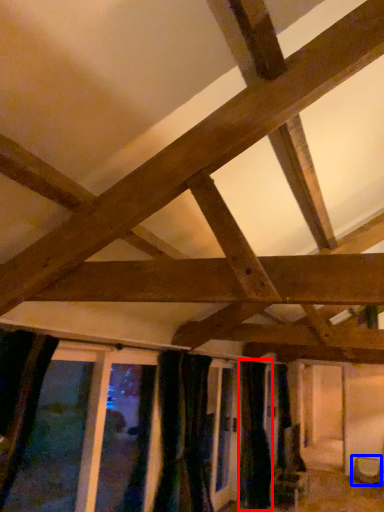
Question: Among these objects, which one is farthest to the camera, curtain (highlighted by a red box) or furniture (highlighted by a blue box)?

Choices:
 (A) curtain
 (B) furniture

Answer: (B)